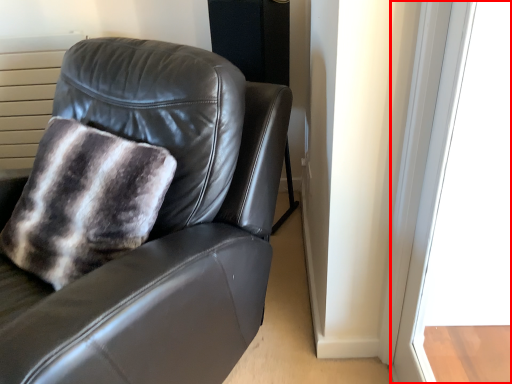
Question: From the image's perspective, what is the correct spatial positioning of window (annotated by the red box) in reference to chair?

Choices:
 (A) above
 (B) below

Answer: (B)